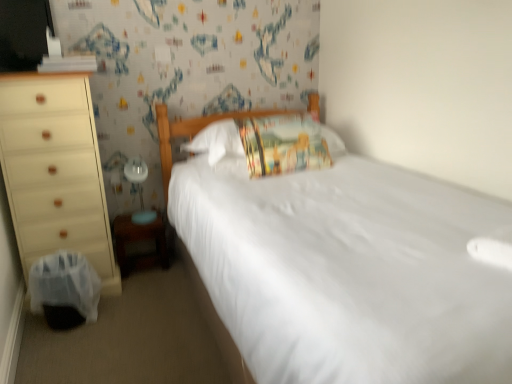
At what (x,y) coordinates should I click in order to perform the action: click on free location above wooden changing table at lower left (from a real-world perspective). Please return your answer as a coordinate pair (x, y). The height and width of the screenshot is (384, 512). Looking at the image, I should click on (141, 218).